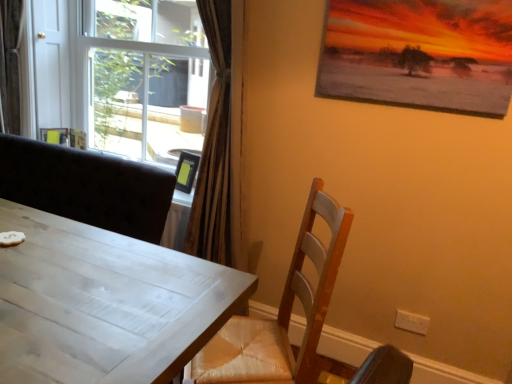
Question: From a real-world perspective, is wooden chair at right on white plastic window at upper left?

Choices:
 (A) no
 (B) yes

Answer: (A)

Question: Can you confirm if wooden chair at right is shorter than white plastic window at upper left?

Choices:
 (A) no
 (B) yes

Answer: (B)

Question: Is wooden chair at right next to white plastic window at upper left and touching it?

Choices:
 (A) yes
 (B) no

Answer: (B)

Question: Considering the relative sizes of wooden chair at right and white plastic window at upper left in the image provided, is wooden chair at right taller than white plastic window at upper left?

Choices:
 (A) no
 (B) yes

Answer: (A)

Question: From the image's perspective, would you say wooden chair at right is positioned over white plastic window at upper left?

Choices:
 (A) no
 (B) yes

Answer: (A)

Question: Relative to white plastic window at upper left, is velvet-like brown curtain at left in front or behind?

Choices:
 (A) behind
 (B) front

Answer: (A)

Question: Is velvet-like brown curtain at left bigger or smaller than white plastic window at upper left?

Choices:
 (A) small
 (B) big

Answer: (A)

Question: Is point (16, 54) positioned closer to the camera than point (53, 41)?

Choices:
 (A) farther
 (B) closer

Answer: (B)

Question: Visually, is velvet-like brown curtain at left positioned to the left or to the right of white plastic window at upper left?

Choices:
 (A) right
 (B) left

Answer: (B)

Question: Is matte wooden picture frame at upper right bigger or smaller than white plastic window at upper left?

Choices:
 (A) big
 (B) small

Answer: (B)

Question: From a real-world perspective, relative to white plastic window at upper left, is matte wooden picture frame at upper right vertically above or below?

Choices:
 (A) above
 (B) below

Answer: (A)

Question: Considering the positions of matte wooden picture frame at upper right and white plastic window at upper left in the image, is matte wooden picture frame at upper right wider or thinner than white plastic window at upper left?

Choices:
 (A) thin
 (B) wide

Answer: (A)

Question: From the image's perspective, is matte wooden picture frame at upper right positioned above or below white plastic window at upper left?

Choices:
 (A) above
 (B) below

Answer: (B)

Question: Is white plastic window at upper left taller or shorter than white wood table at left?

Choices:
 (A) tall
 (B) short

Answer: (A)

Question: Is white plastic window at upper left wider or thinner than white wood table at left?

Choices:
 (A) wide
 (B) thin

Answer: (A)